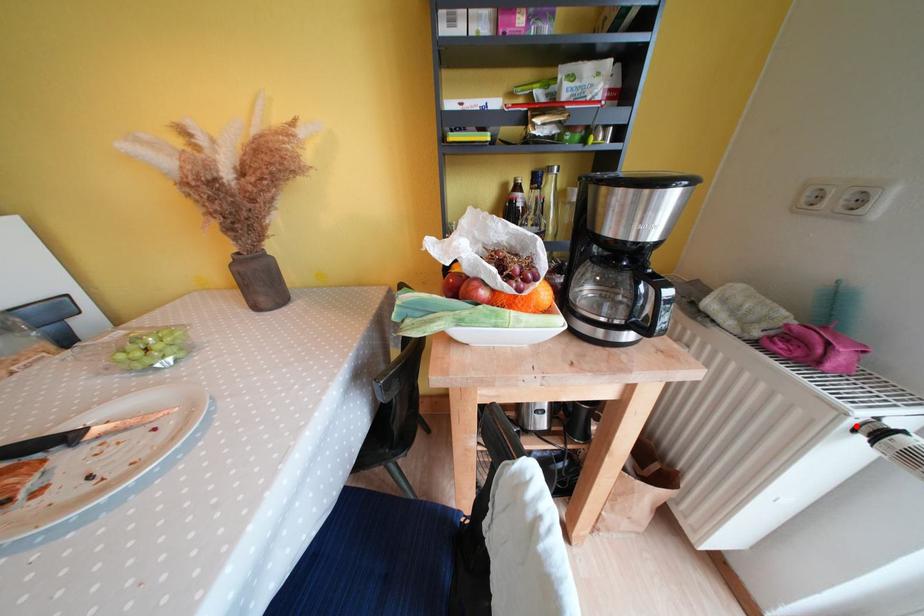
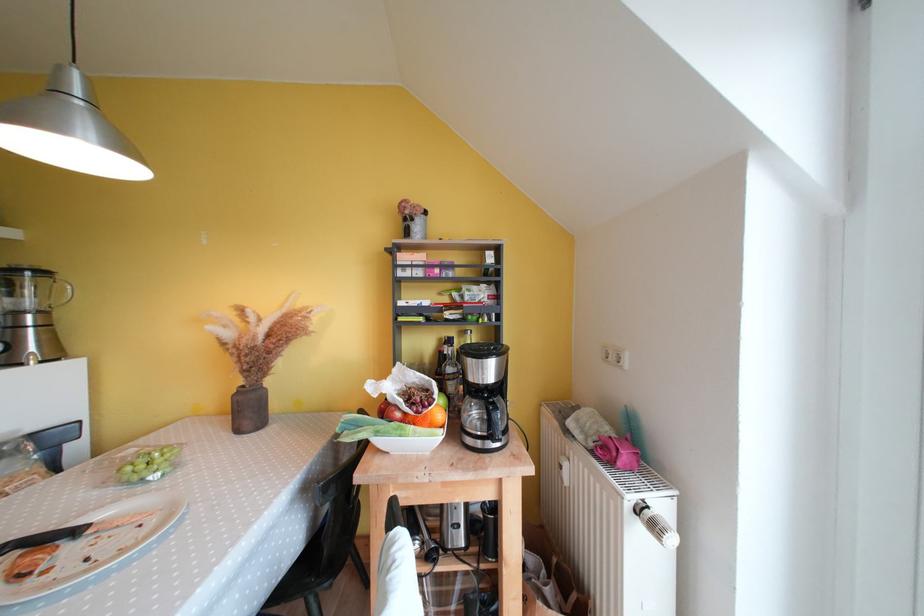
In the second image, find the point that corresponds to the highlighted location in the first image.

(634, 509)